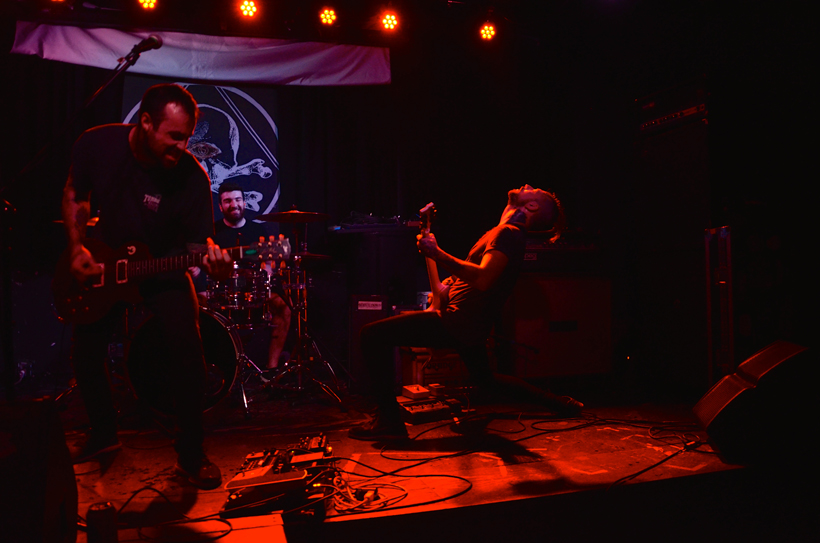
At what (x,y) coordinates should I click in order to perform the action: click on cords. Please return your answer as a coordinate pair (x, y). The image size is (820, 543). Looking at the image, I should click on (597, 421), (661, 460), (357, 488), (449, 451), (134, 479), (224, 521), (82, 467).